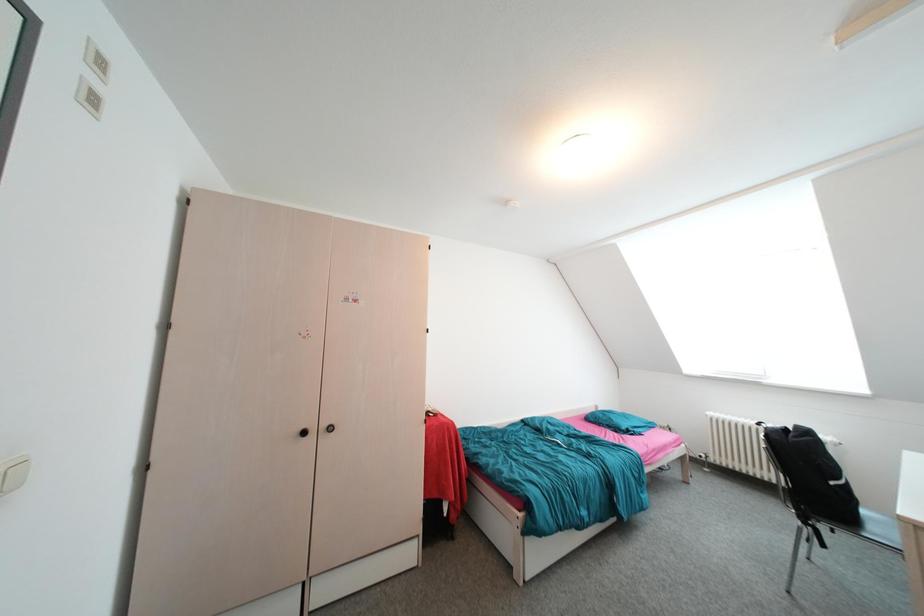
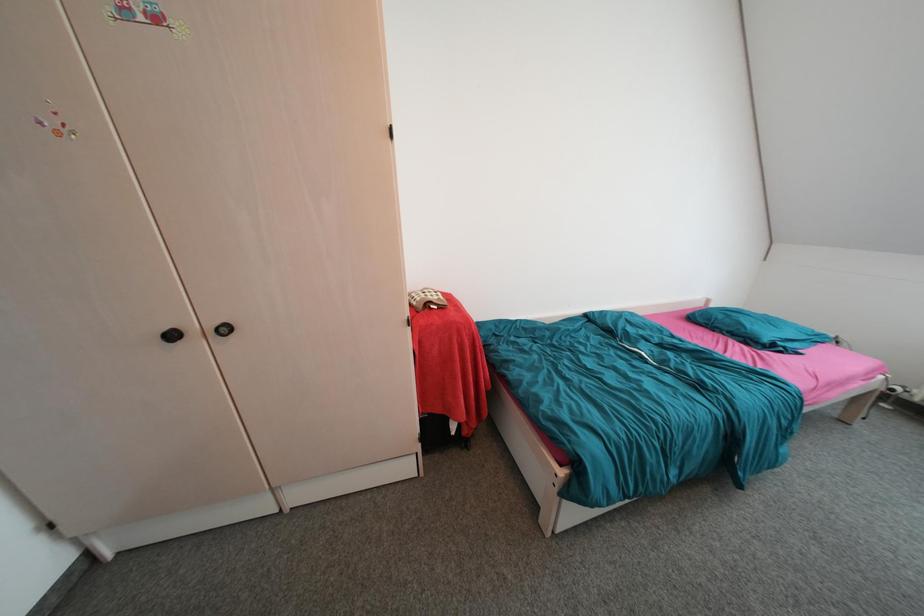
Question: How did the camera likely rotate?

Choices:
 (A) Left
 (B) Right
 (C) Up
 (D) Down

Answer: (D)